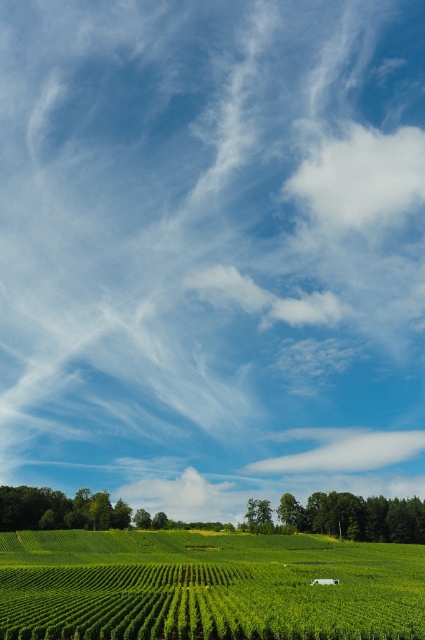
You are a farmer planning to plant new crops in the green leafy field at lower center and the green leafy trees at center. Which area is closer to you if you are standing at the edge of the image?

The green leafy field at lower center is closer to you because it is positioned over the green leafy trees at center, meaning it is in front of them.

You are standing at the edge of the vineyard fields and see two points marked in the scene. Which point, point (133, 595) or point (342, 132), is closer to you?

Point (133, 595) is closer to you because it is in front of point (342, 132).